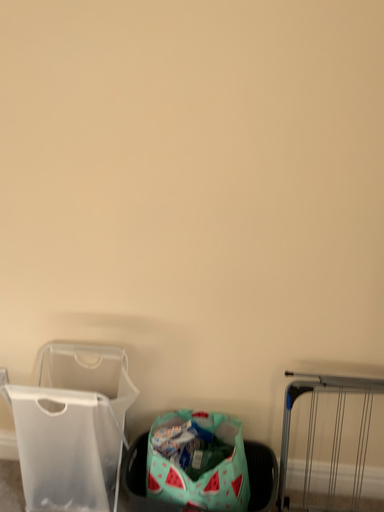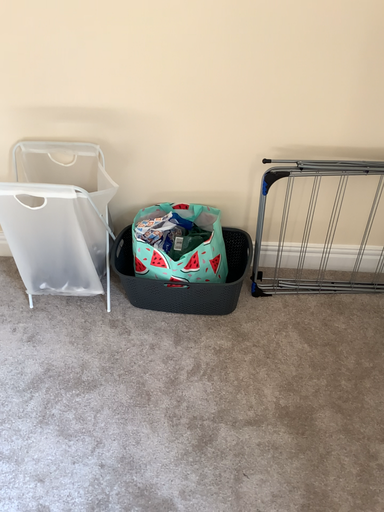
Question: How did the camera likely rotate when shooting the video?

Choices:
 (A) rotated downward
 (B) rotated upward

Answer: (A)